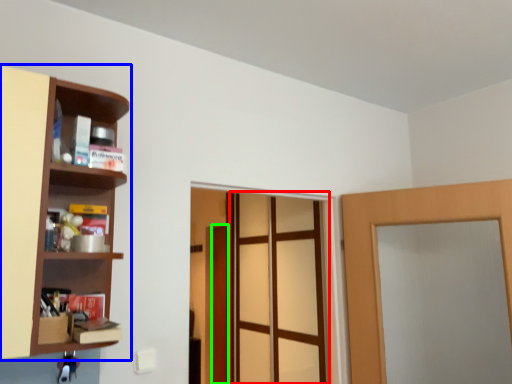
Question: Considering the real-world distances, which object is closest to screen door (highlighted by a red box)? shelf (highlighted by a blue box) or door (highlighted by a green box).

Choices:
 (A) shelf
 (B) door

Answer: (B)